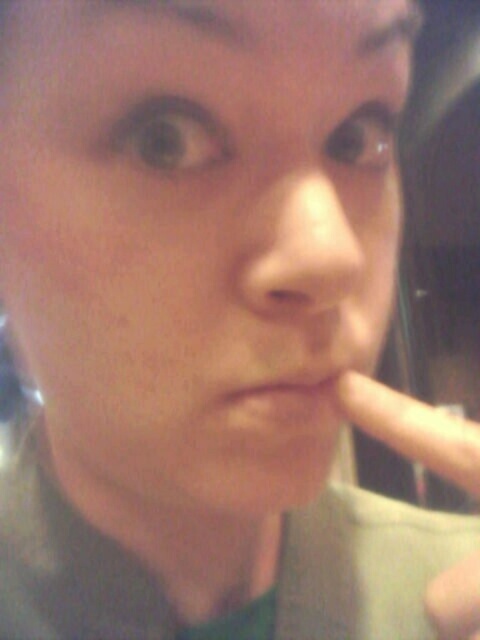
Between point (241, 280) and point (320, 403), which one is positioned behind?

Positioned behind is point (320, 403).

Is smooth skin nose at center bigger than matte skin at center?

Correct, smooth skin nose at center is larger in size than matte skin at center.

Is point (322, 273) positioned in front of point (241, 406)?

Yes, it is in front of point (241, 406).

Identify the location of smooth skin nose at center. This screenshot has height=640, width=480. [x=299, y=250].